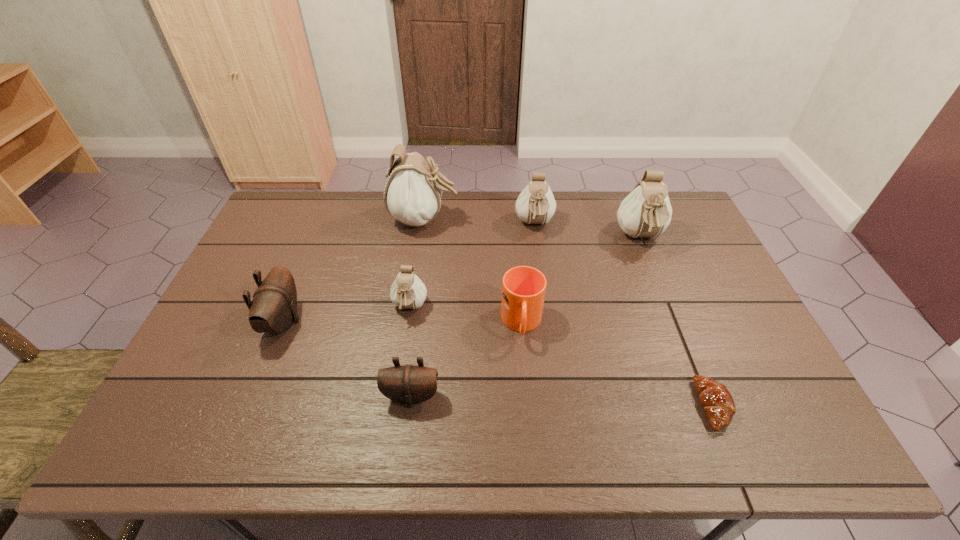
This screenshot has height=540, width=960. In order to click on the tallest pouch in this screenshot , I will do `click(412, 195)`.

Locate an element on the screen. The height and width of the screenshot is (540, 960). the biggest white pouch is located at coordinates (412, 195).

Find the location of a particular element. The width and height of the screenshot is (960, 540). the third smallest white pouch is located at coordinates (646, 212).

You are a GUI agent. You are given a task and a screenshot of the screen. Output one action in this format:
    pyautogui.click(x=<x>, y=<y>)
    Task: Click on the rightmost white pouch
    
    Given the screenshot: What is the action you would take?
    pyautogui.click(x=646, y=212)

The width and height of the screenshot is (960, 540). In order to click on the second pouch from right to left in this screenshot , I will do `click(535, 205)`.

In order to click on the third biggest white pouch in this screenshot , I will do `click(535, 205)`.

The width and height of the screenshot is (960, 540). I want to click on the left brown pouch, so click(x=273, y=308).

Locate an element on the screen. This screenshot has width=960, height=540. the bigger brown pouch is located at coordinates (273, 308).

At what (x,y) coordinates should I click in order to perform the action: click on mug. Please return your answer as a coordinate pair (x, y). Looking at the image, I should click on (523, 288).

You are a GUI agent. You are given a task and a screenshot of the screen. Output one action in this format:
    pyautogui.click(x=<x>, y=<y>)
    Task: Click on the smallest white pouch
    The width and height of the screenshot is (960, 540).
    Given the screenshot: What is the action you would take?
    pyautogui.click(x=407, y=291)